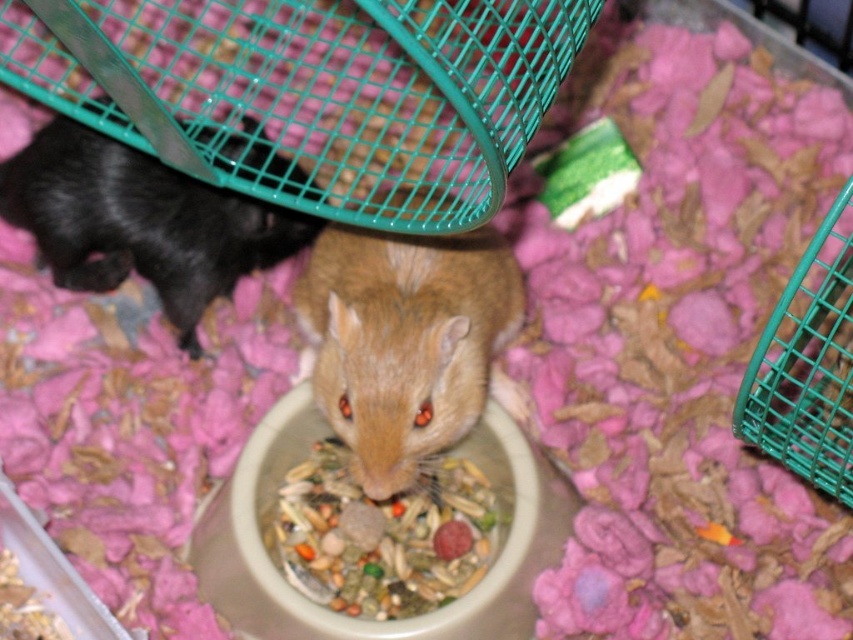
Question: Which of the following is the closest to the observer?

Choices:
 (A) multicolored grain mix at center
 (B) black matte/black fur mouse at left
 (C) fuzzy brown hamster at center

Answer: (C)

Question: Can you confirm if black matte/black fur mouse at left is positioned below multicolored grain mix at center?

Choices:
 (A) yes
 (B) no

Answer: (B)

Question: Estimate the real-world distances between objects in this image. Which object is closer to the black matte/black fur mouse at left?

Choices:
 (A) fuzzy brown hamster at center
 (B) multicolored grain mix at center

Answer: (A)

Question: Does black matte/black fur mouse at left have a lesser width compared to multicolored grain mix at center?

Choices:
 (A) yes
 (B) no

Answer: (B)

Question: Which object is the closest to the black matte/black fur mouse at left?

Choices:
 (A) multicolored grain mix at center
 (B) fuzzy brown hamster at center

Answer: (B)

Question: Is fuzzy brown hamster at center above black matte/black fur mouse at left?

Choices:
 (A) no
 (B) yes

Answer: (A)